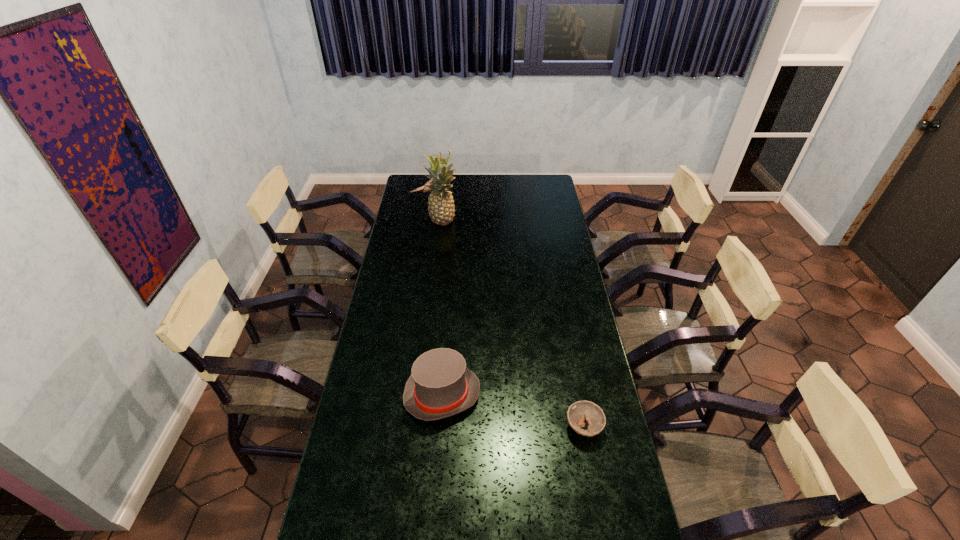
You are a GUI agent. You are given a task and a screenshot of the screen. Output one action in this format:
    pyautogui.click(x=<x>, y=<y>)
    Task: Click on the vacant point located between the shortest object and the dress hat
    
    Given the screenshot: What is the action you would take?
    pyautogui.click(x=513, y=410)

At what (x,y) coordinates should I click in order to perform the action: click on unoccupied position between the dress hat and the tallest object. Please return your answer as a coordinate pair (x, y). Image resolution: width=960 pixels, height=540 pixels. Looking at the image, I should click on (443, 308).

Identify which object is the third closest to the second farthest object. Please provide its 2D coordinates. Your answer should be formatted as a tuple, i.e. [(x, y)], where the tuple contains the x and y coordinates of a point satisfying the conditions above.

[(579, 411)]

Point out which object is positioned as the second nearest to the pineapple. Please provide its 2D coordinates. Your answer should be formatted as a tuple, i.e. [(x, y)], where the tuple contains the x and y coordinates of a point satisfying the conditions above.

[(440, 386)]

Locate an element on the screen. The width and height of the screenshot is (960, 540). free space that satisfies the following two spatial constraints: 1. at the face of the farthest object; 2. on the right side of the dress hat is located at coordinates (395, 394).

At what (x,y) coordinates should I click in order to perform the action: click on blank space that satisfies the following two spatial constraints: 1. at the face of the dress hat; 2. on the left side of the bird. Please return your answer as a coordinate pair (x, y). Looking at the image, I should click on (395, 394).

Image resolution: width=960 pixels, height=540 pixels. In order to click on free space that satisfies the following two spatial constraints: 1. at the face of the dress hat; 2. on the right side of the farthest object in this screenshot , I will do `click(395, 394)`.

What are the coordinates of `vacant point that satisfies the following two spatial constraints: 1. at the face of the bird; 2. on the left side of the pineapple` in the screenshot? It's located at (423, 222).

Where is `vacant area in the image that satisfies the following two spatial constraints: 1. on the front side of the rightmost object; 2. on the right side of the second farthest object`? This screenshot has height=540, width=960. vacant area in the image that satisfies the following two spatial constraints: 1. on the front side of the rightmost object; 2. on the right side of the second farthest object is located at coordinates (420, 427).

Identify the location of free space that satisfies the following two spatial constraints: 1. at the face of the bird; 2. on the right side of the tallest object. The width and height of the screenshot is (960, 540). (423, 222).